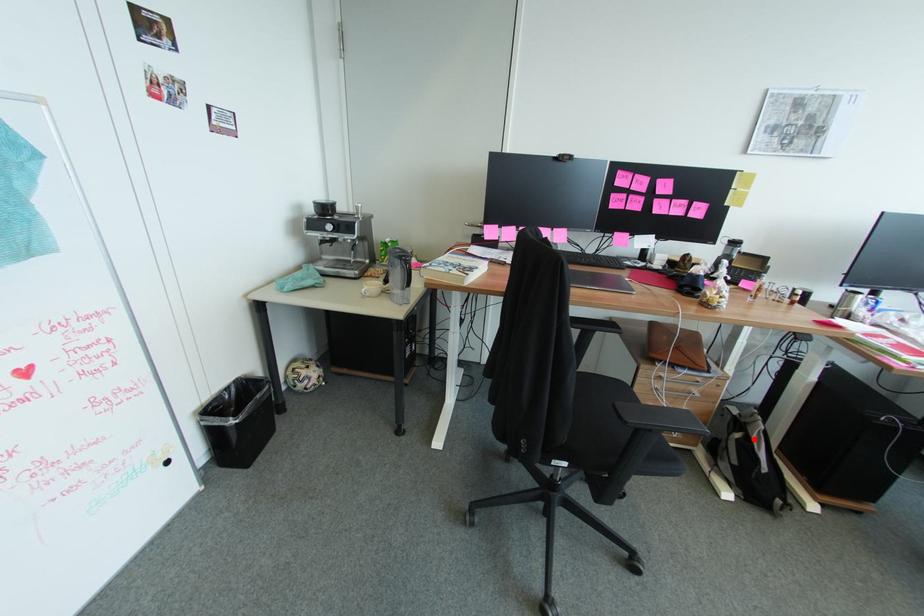
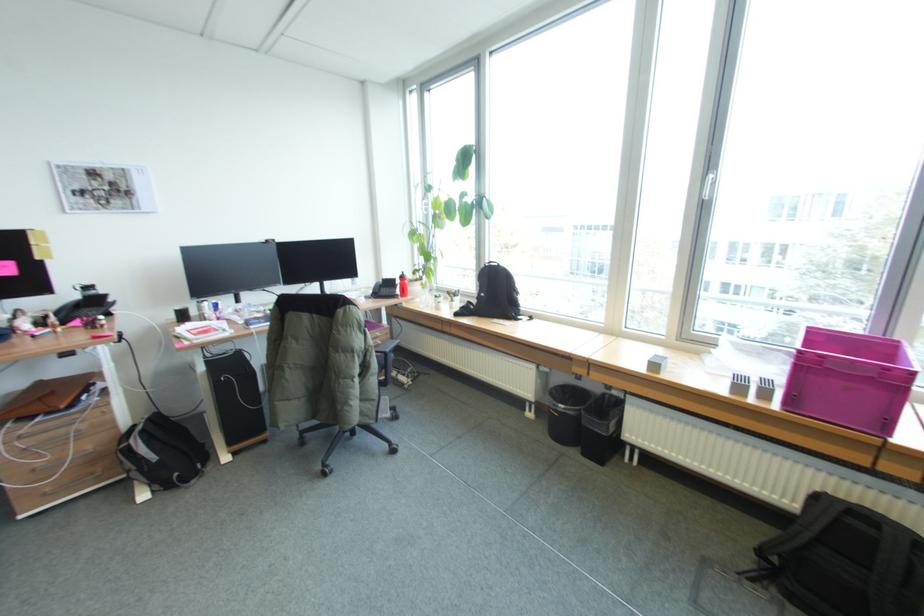
Question: I am providing you with two images of the same scene from different viewpoints. A red point is shown in image1. For the corresponding object point in image2, is it positioned nearer or farther from the camera?

Choices:
 (A) Nearer
 (B) Farther

Answer: (A)